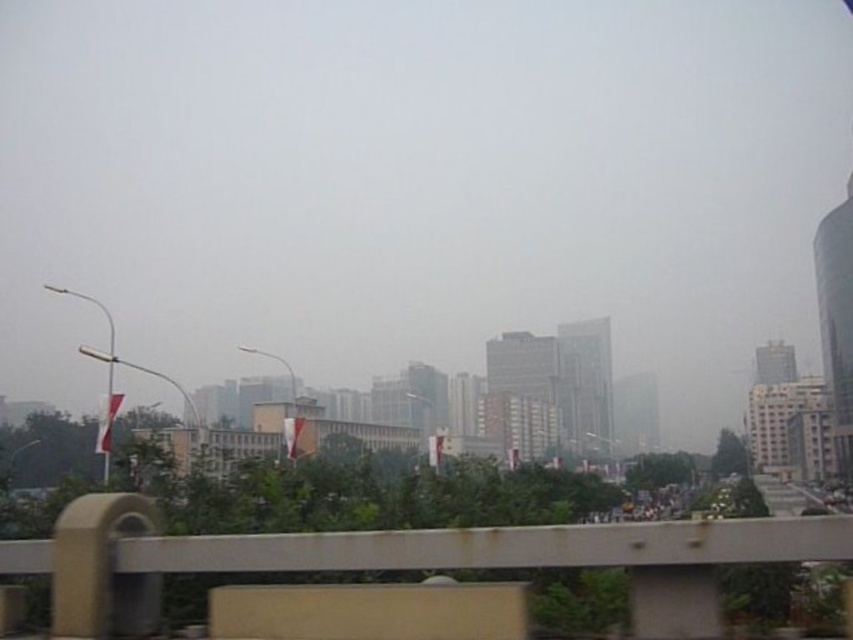
How distant is rusty metal overpass at lower center from white fabric flag at left?

A distance of 12.07 meters exists between rusty metal overpass at lower center and white fabric flag at left.

Consider the image. Is rusty metal overpass at lower center behind white fabric flag at left?

No, it is in front of white fabric flag at left.

Identify the location of rusty metal overpass at lower center. This screenshot has width=853, height=640. (402, 560).